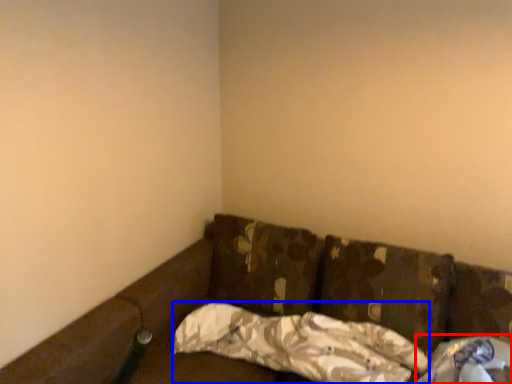
Question: Which object appears closest to the camera in this image, material (highlighted by a red box) or pillow (highlighted by a blue box)?

Choices:
 (A) material
 (B) pillow

Answer: (A)